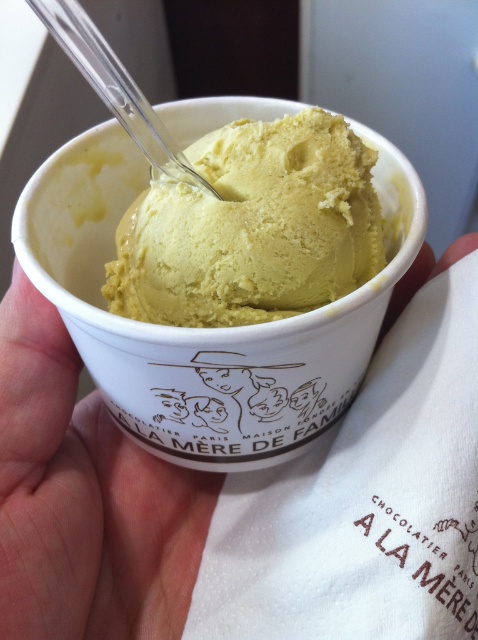
Who is more forward, (210, 499) or (95, 77)?

Positioned in front is point (95, 77).

Is smooth skin at center positioned behind transparent plastic spoon at upper center?

Yes, it is behind transparent plastic spoon at upper center.

Measure the distance between point (61, 589) and camera.

A distance of 1.02 meters exists between point (61, 589) and camera.

Locate an element on the screen. smooth skin at center is located at coordinates (85, 499).

Does smooth skin at center have a greater height compared to yellow matte ice cream at center?

Correct, smooth skin at center is much taller as yellow matte ice cream at center.

Which of these two, smooth skin at center or yellow matte ice cream at center, stands taller?

smooth skin at center

Where is `smooth skin at center`? This screenshot has width=478, height=640. smooth skin at center is located at coordinates (85, 499).

Does yellow matte ice cream at center appear over transparent plastic spoon at upper center?

No, yellow matte ice cream at center is not above transparent plastic spoon at upper center.

Does yellow matte ice cream at center have a greater width compared to transparent plastic spoon at upper center?

Correct, the width of yellow matte ice cream at center exceeds that of transparent plastic spoon at upper center.

The height and width of the screenshot is (640, 478). Find the location of `yellow matte ice cream at center`. yellow matte ice cream at center is located at coordinates (252, 227).

This screenshot has width=478, height=640. Identify the location of yellow matte ice cream at center. (252, 227).